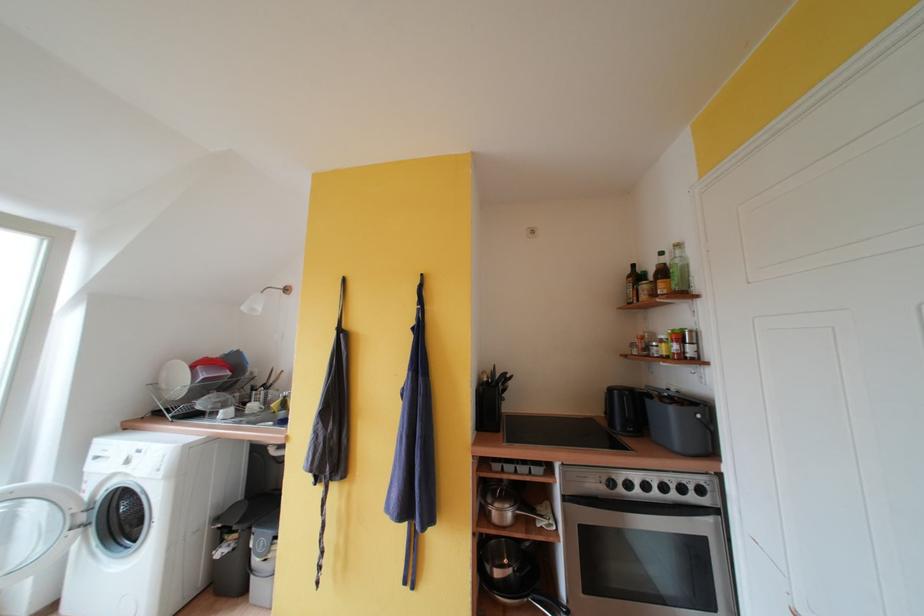
The width and height of the screenshot is (924, 616). Describe the element at coordinates (678, 422) in the screenshot. I see `the gray toaster` at that location.